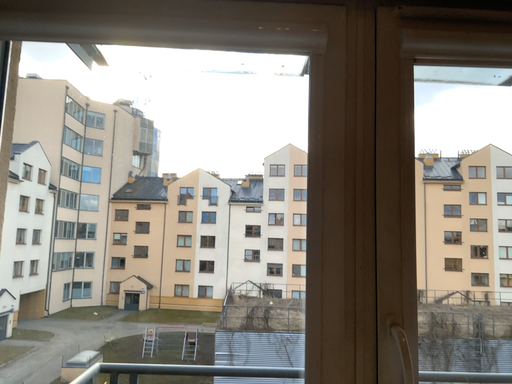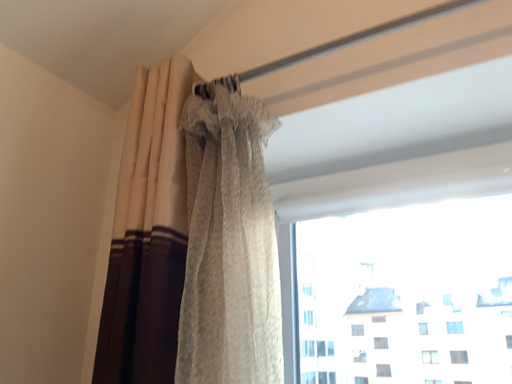
Question: How did the camera likely rotate when shooting the video?

Choices:
 (A) rotated left
 (B) rotated right

Answer: (A)